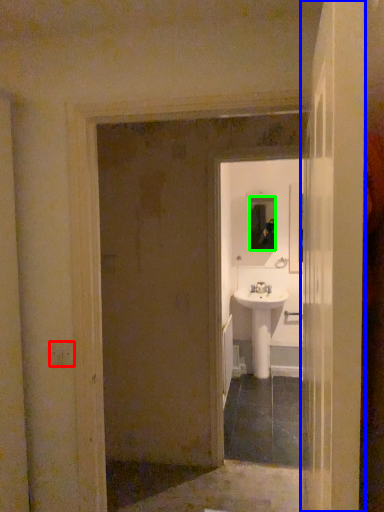
Question: Which object is positioned farthest from light switch (highlighted by a red box)? Select from door (highlighted by a blue box) and mirror (highlighted by a green box).

Choices:
 (A) door
 (B) mirror

Answer: (B)